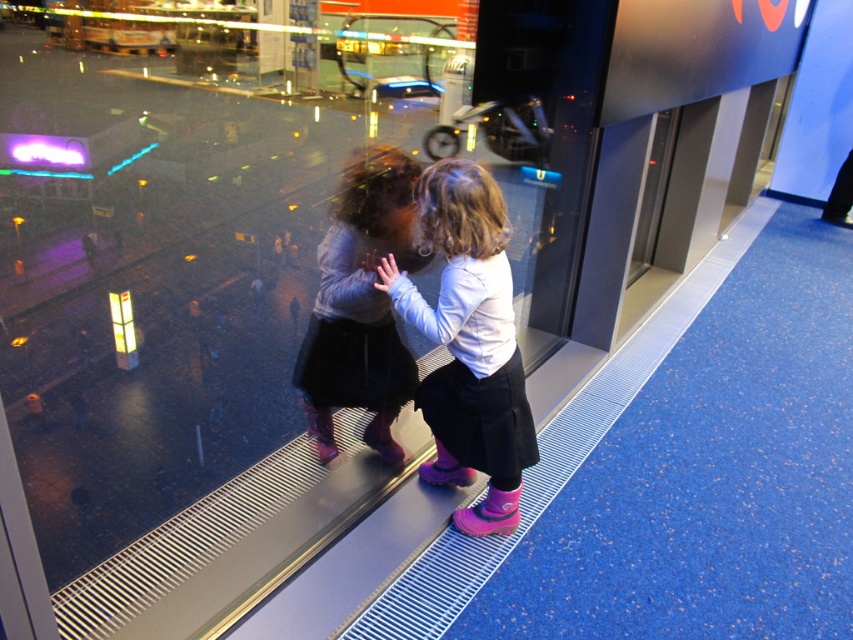
You are a photographer trying to capture a clear shot of the matte gray sweater at center and the pink rubber boots at center. Since the window is reflecting both the indoor lights and the wet street outside, which object should you focus on first to ensure it appears sharp in the photo?

The pink rubber boots at center is closer to the viewer than the matte gray sweater at center, so focusing on the pink rubber boots at center first will ensure it stays sharp as the distance between the two objects may cause depth of field issues.

You are a delivery person who needs to place a package on the floor in the image. The package must be placed at the exact location of the pink rubber boots at center. What are the coordinates where you should place the package?

The coordinates for the pink rubber boots at center are at point (469, 344). Place the package there.

You are a delivery drone trying to navigate through the window. You see two points marked in the image. The first point is at coordinate point (444, 182) and the second is at point (370, 372). Which point is closer to the window surface?

Point (444, 182) is in front of point (370, 372), so it is closer to the window surface.